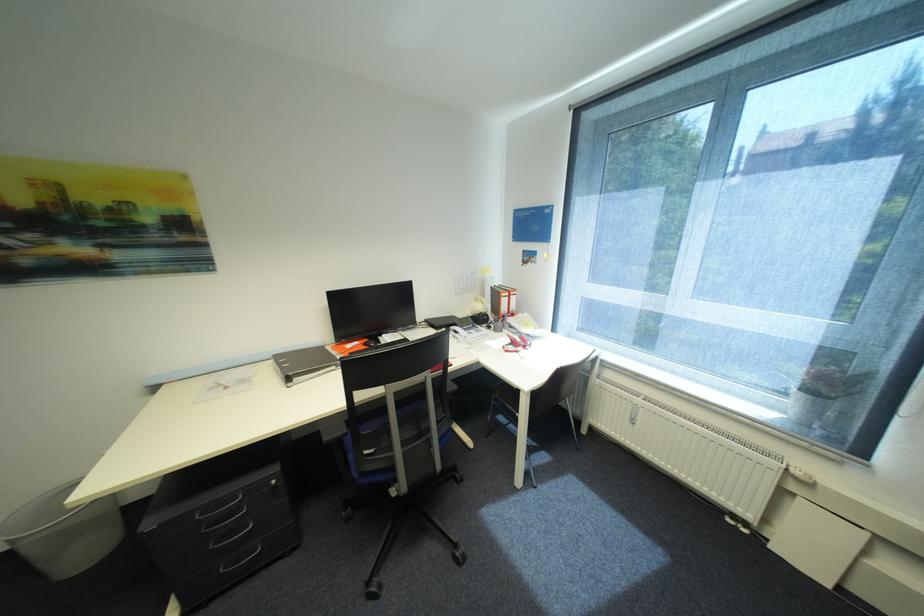
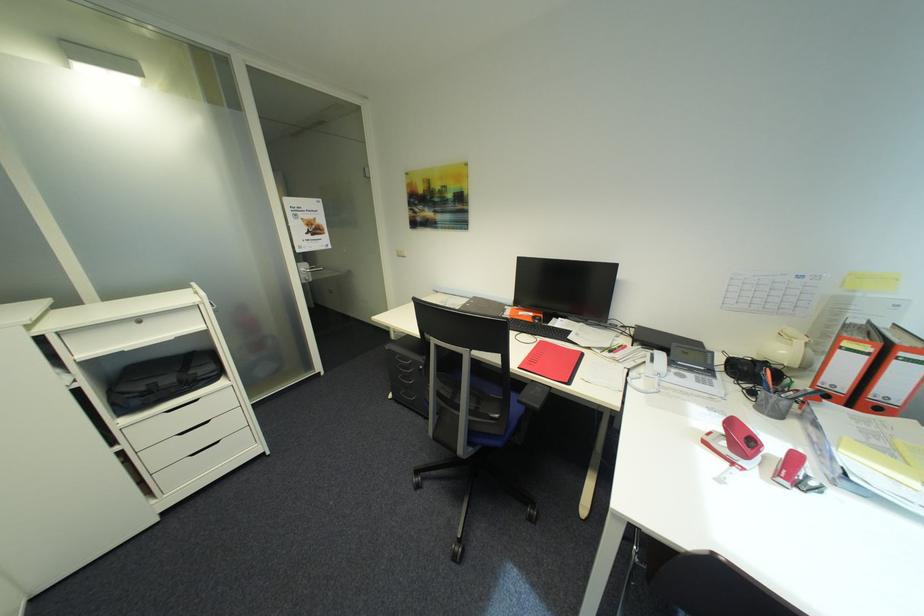
Where in the second image is the point corresponding to pixel 525 352 from the first image?

(742, 464)